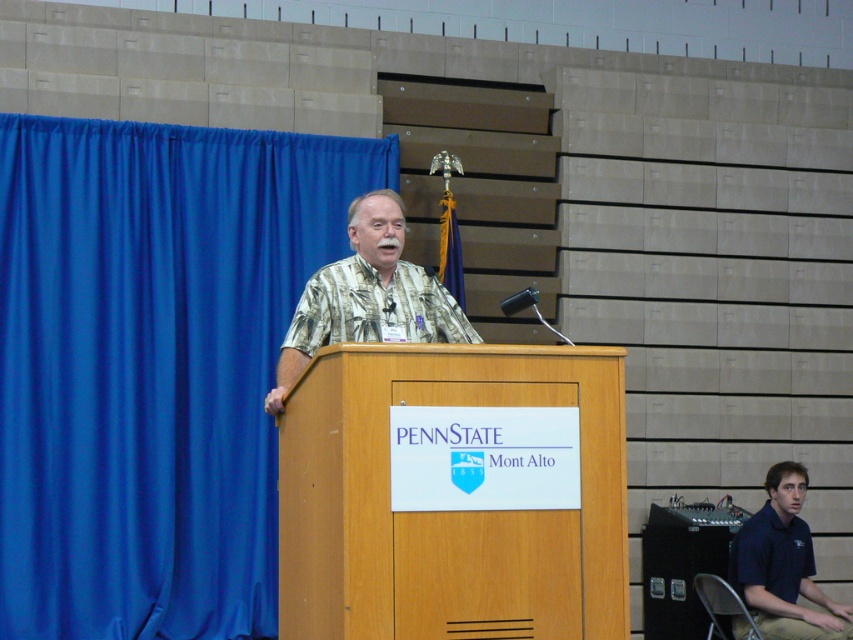
Does point (68, 252) come in front of point (664, 522)?

That is True.

Which is in front, point (102, 480) or point (730, 531)?

Point (102, 480)

Locate an element on the screen. The width and height of the screenshot is (853, 640). blue fabric curtain at left is located at coordinates [x=152, y=364].

Is dark blue shirt at lower right in front of black plastic speaker at lower right?

Yes.

Can you confirm if dark blue shirt at lower right is positioned to the left of black plastic speaker at lower right?

No, dark blue shirt at lower right is not to the left of black plastic speaker at lower right.

At what (x,y) coordinates should I click in order to perform the action: click on dark blue shirt at lower right. Please return your answer as a coordinate pair (x, y). The width and height of the screenshot is (853, 640). Looking at the image, I should click on (782, 564).

Does printed fabric shirt at center have a lesser height compared to black plastic speaker at lower right?

Incorrect, printed fabric shirt at center's height does not fall short of black plastic speaker at lower right's.

Which is below, printed fabric shirt at center or black plastic speaker at lower right?

black plastic speaker at lower right is lower down.

Who is more distant from viewer, (436,323) or (697,627)?

The point (697,627) is behind.

Identify the location of printed fabric shirt at center. The width and height of the screenshot is (853, 640). (368, 296).